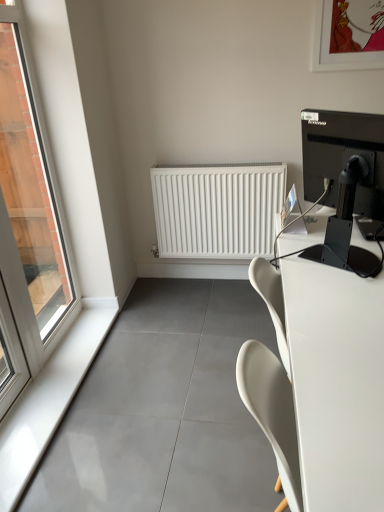
Question: Is white glossy window sill at left smaller than clear glass window at left?

Choices:
 (A) no
 (B) yes

Answer: (B)

Question: Is white glossy window sill at left far away from clear glass window at left?

Choices:
 (A) yes
 (B) no

Answer: (B)

Question: Considering the relative positions of white glossy window sill at left and clear glass window at left in the image provided, is white glossy window sill at left to the right of clear glass window at left from the viewer's perspective?

Choices:
 (A) no
 (B) yes

Answer: (B)

Question: Is white glossy window sill at left beside clear glass window at left?

Choices:
 (A) no
 (B) yes

Answer: (A)

Question: Is white glossy window sill at left behind clear glass window at left?

Choices:
 (A) yes
 (B) no

Answer: (A)

Question: From the image's perspective, relative to white matte radiator at center, is white glossy desk at right above or below?

Choices:
 (A) above
 (B) below

Answer: (B)

Question: Considering the positions of white glossy desk at right and white matte radiator at center in the image, is white glossy desk at right wider or thinner than white matte radiator at center?

Choices:
 (A) wide
 (B) thin

Answer: (A)

Question: Is white glossy desk at right taller or shorter than white matte radiator at center?

Choices:
 (A) tall
 (B) short

Answer: (A)

Question: From a real-world perspective, is white glossy desk at right above or below white matte radiator at center?

Choices:
 (A) below
 (B) above

Answer: (A)

Question: Looking at their shapes, would you say clear glass window at left is wider or thinner than black glossy monitor at upper right?

Choices:
 (A) wide
 (B) thin

Answer: (B)

Question: Is clear glass window at left inside the boundaries of black glossy monitor at upper right, or outside?

Choices:
 (A) inside
 (B) outside

Answer: (B)

Question: Looking at the image, does clear glass window at left seem bigger or smaller compared to black glossy monitor at upper right?

Choices:
 (A) small
 (B) big

Answer: (B)

Question: Is clear glass window at left to the left or to the right of black glossy monitor at upper right in the image?

Choices:
 (A) right
 (B) left

Answer: (B)

Question: Relative to white glossy window sill at left, is white matte radiator at center in front or behind?

Choices:
 (A) front
 (B) behind

Answer: (B)

Question: In the image, is white matte radiator at center on the left side or the right side of white glossy window sill at left?

Choices:
 (A) right
 (B) left

Answer: (A)